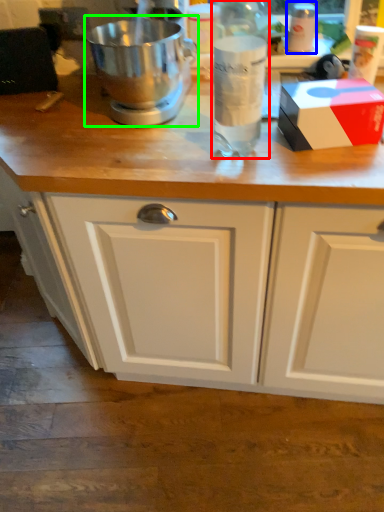
Question: Which object is positioned farthest from bottle (highlighted by a red box)? Select from bottle (highlighted by a blue box) and mixer (highlighted by a green box).

Choices:
 (A) bottle
 (B) mixer

Answer: (A)